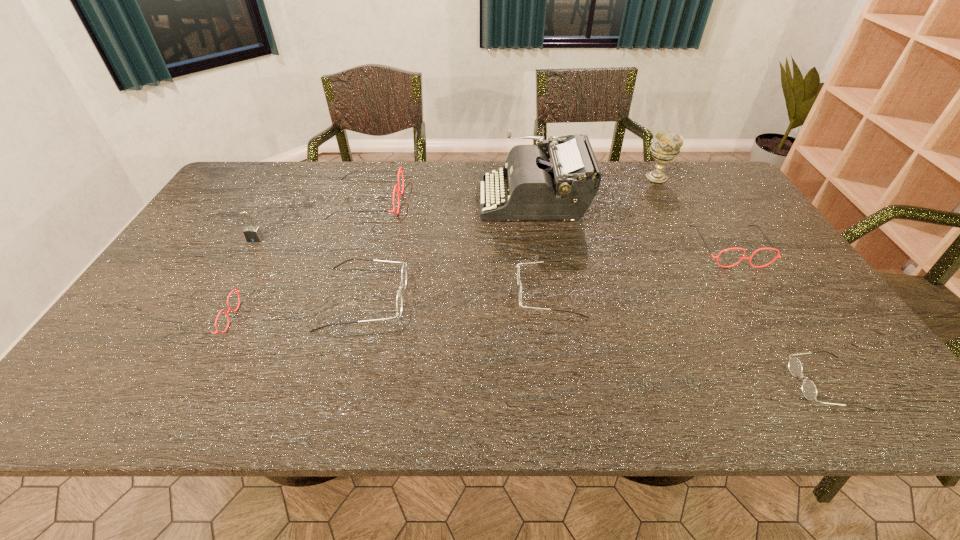
This screenshot has height=540, width=960. In order to click on typewriter that is at the far edge in this screenshot , I will do `click(561, 185)`.

This screenshot has height=540, width=960. In order to click on chalice at the far edge in this screenshot , I will do click(665, 146).

At what (x,y) coordinates should I click in order to perform the action: click on spectacles located in the far edge section of the desktop. Please return your answer as a coordinate pair (x, y). The height and width of the screenshot is (540, 960). Looking at the image, I should click on pyautogui.click(x=398, y=191).

Identify the location of object present at the near edge. (809, 390).

I want to click on object that is at the left edge, so click(x=237, y=291).

The height and width of the screenshot is (540, 960). In order to click on object at the near right corner in this screenshot , I will do `click(809, 390)`.

This screenshot has width=960, height=540. In order to click on free space at the far edge in this screenshot , I will do `click(432, 161)`.

Find the location of a particular element. The height and width of the screenshot is (540, 960). free space at the left edge of the desktop is located at coordinates (224, 229).

Locate an element on the screen. vacant position at the right edge of the desktop is located at coordinates (769, 258).

You are a GUI agent. You are given a task and a screenshot of the screen. Output one action in this format:
    pyautogui.click(x=<x>, y=<y>)
    Task: Click on the free location at the far left corner of the desktop
    
    Given the screenshot: What is the action you would take?
    pyautogui.click(x=255, y=197)